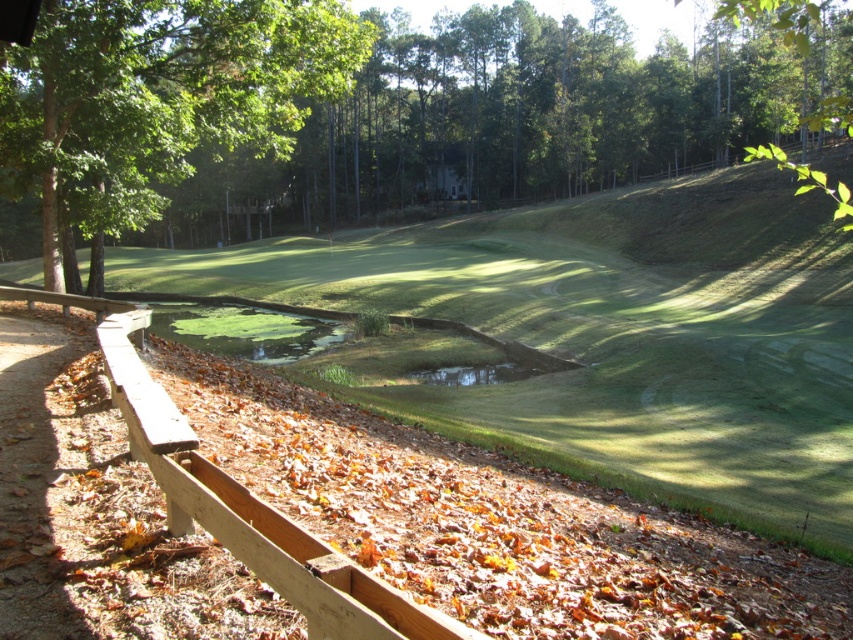
Based on the scene description, where is the green leafy tree at upper center located in terms of coordinates?

The green leafy tree at upper center is located at point (x=525, y=116).

From the picture: You are a golfer trying to hit the ball into the green grass hole at center. There is a green leafy tree at upper left in your way. Can you determine if the tree is large enough to block your shot?

The green leafy tree at upper left is bigger than the green grass hole at center, so it might block your shot depending on the angle and distance.